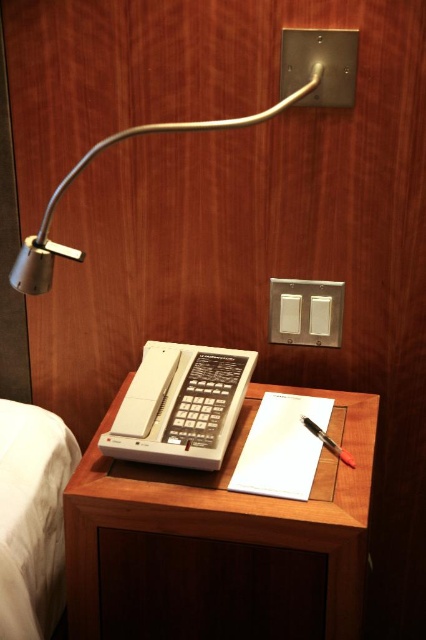
Does white fabric bed at lower left have a lesser height compared to black plastic pen at center?

In fact, white fabric bed at lower left may be taller than black plastic pen at center.

Is point (46, 595) positioned in front of point (308, 429)?

No, (46, 595) is further to viewer.

Where is `white fabric bed at lower left`? This screenshot has width=426, height=640. white fabric bed at lower left is located at coordinates (31, 518).

Locate an element on the screen. white fabric bed at lower left is located at coordinates (31, 518).

Who is positioned more to the right, white plastic phone at center or black plastic pen at center?

Positioned to the right is black plastic pen at center.

Which is more to the left, white plastic phone at center or black plastic pen at center?

white plastic phone at center

The width and height of the screenshot is (426, 640). What do you see at coordinates (181, 404) in the screenshot? I see `white plastic phone at center` at bounding box center [181, 404].

This screenshot has width=426, height=640. I want to click on white plastic phone at center, so click(181, 404).

Who is positioned more to the right, wooden table at center or satin silver lamp at upper center?

Positioned to the right is wooden table at center.

Can you confirm if wooden table at center is thinner than satin silver lamp at upper center?

Yes.

The height and width of the screenshot is (640, 426). Find the location of `wooden table at center`. wooden table at center is located at coordinates (218, 524).